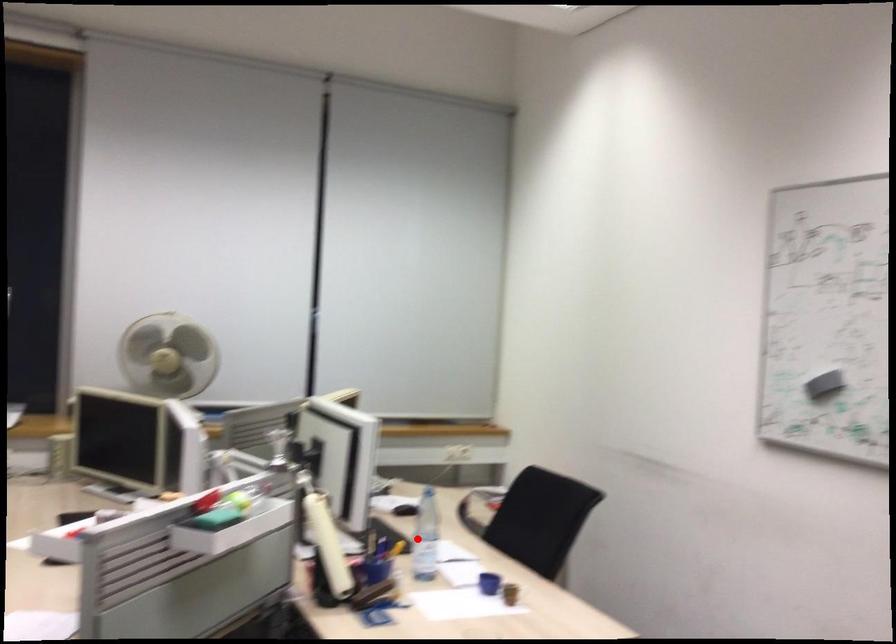
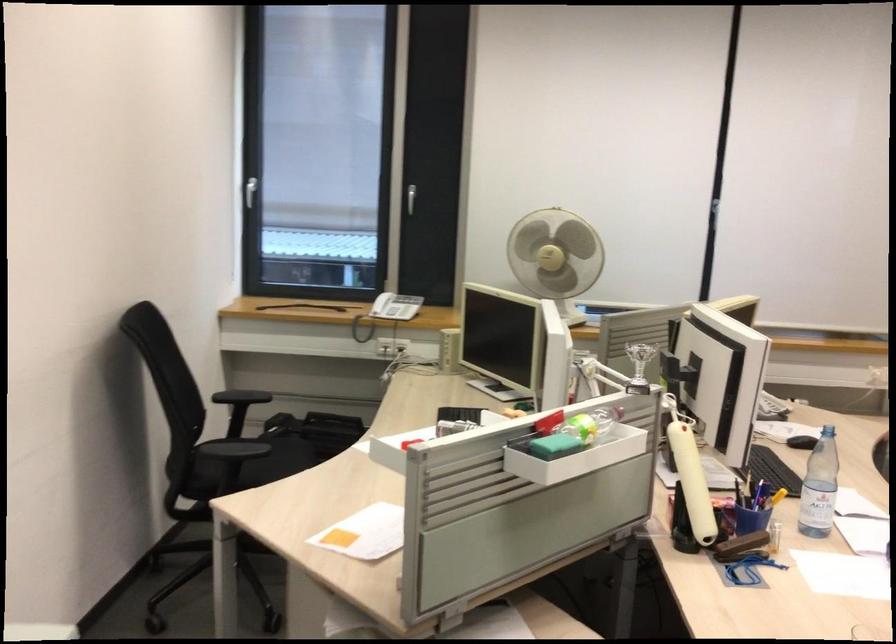
The point at the highlighted location is marked in the first image. Where is the corresponding point in the second image?

(819, 487)